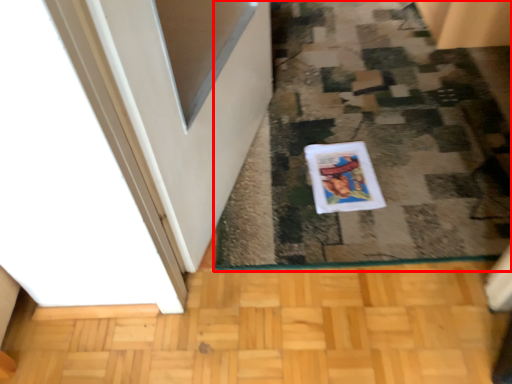
Question: Considering the relative positions of doormat (annotated by the red box) and comic book in the image provided, where is doormat (annotated by the red box) located with respect to the staircase?

Choices:
 (A) left
 (B) right

Answer: (B)